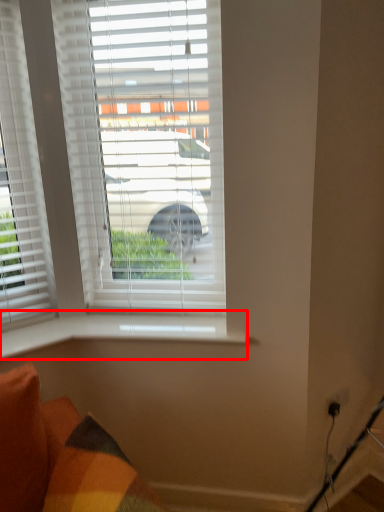
Question: From the image's perspective, what is the correct spatial relationship of window sill (annotated by the red box) in relation to window?

Choices:
 (A) below
 (B) above

Answer: (A)